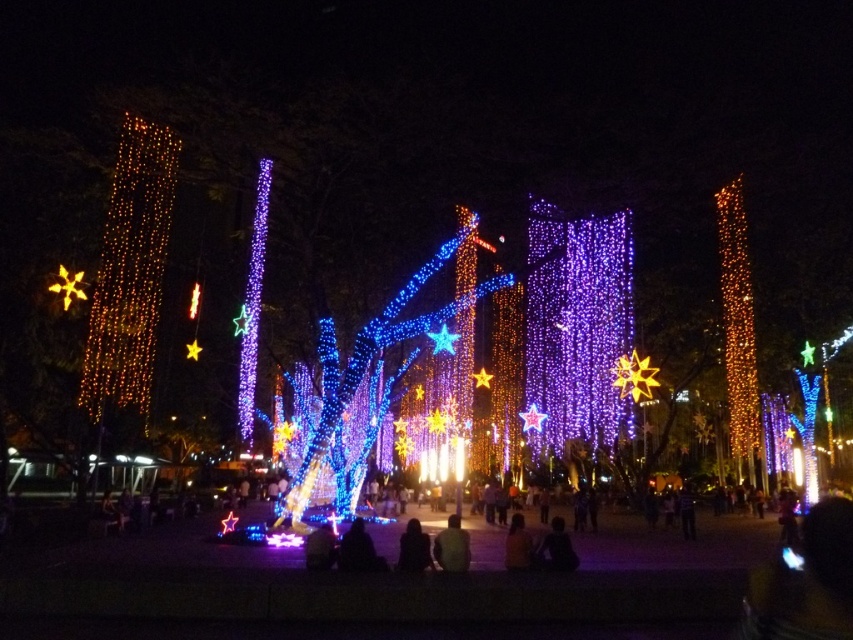
You are a photographer trying to capture a clear photo of the black matte person at center without the warm golden lights at left blocking them. Based on the scene, can you position yourself in a way to achieve this?

The black matte person at center is behind the warm golden lights at left, so if you move to a position where the warm golden lights at left are no longer between you and the black matte person at center, you can capture a clear photo without obstruction.

You are standing in the festive nighttime scene and want to take a photo of the warm golden lights at left. Where should you position yourself to capture them in the frame?

To capture the warm golden lights at left in your photo, position yourself so that the lights are centered at coordinate point 0.425 on the x axis and 0.154 on the y axis.